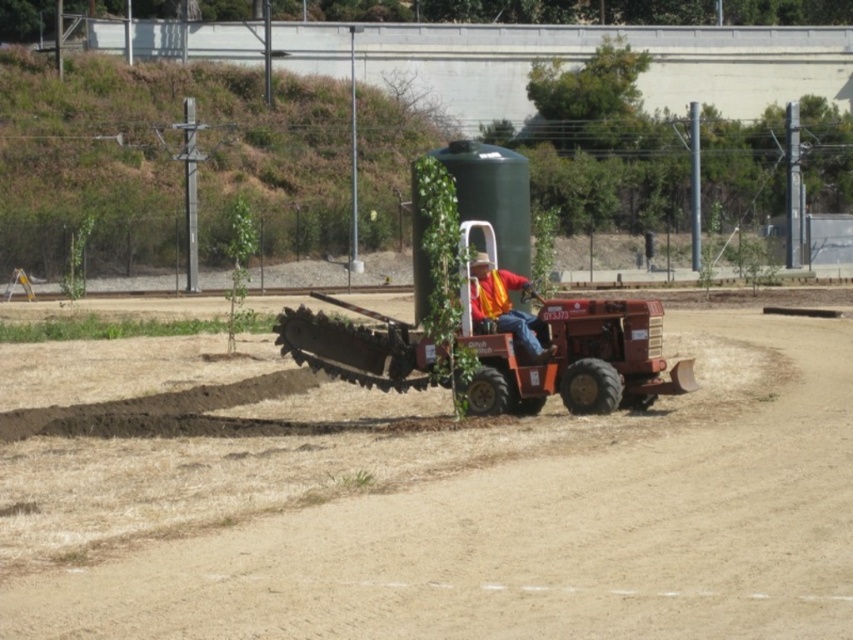
You are a safety inspector checking the tractor operator. You notice the orange reflective vest at center and the brown dry soil at center. Which object takes up more space in the image?

The brown dry soil at center is bigger than the orange reflective vest at center, so it takes up more space in the image.

You are standing in the field and want to approach the green matte water tank at center. Which direction should you move relative to the matte orange tractor at center?

To reach the green matte water tank at center, you should move to the right of the matte orange tractor at center since the tractor is positioned to the left of the tank.

Based on the coordinates provided, which object in the scene is located at point (575, 358)?

The matte orange tractor at center is located at point (575, 358).